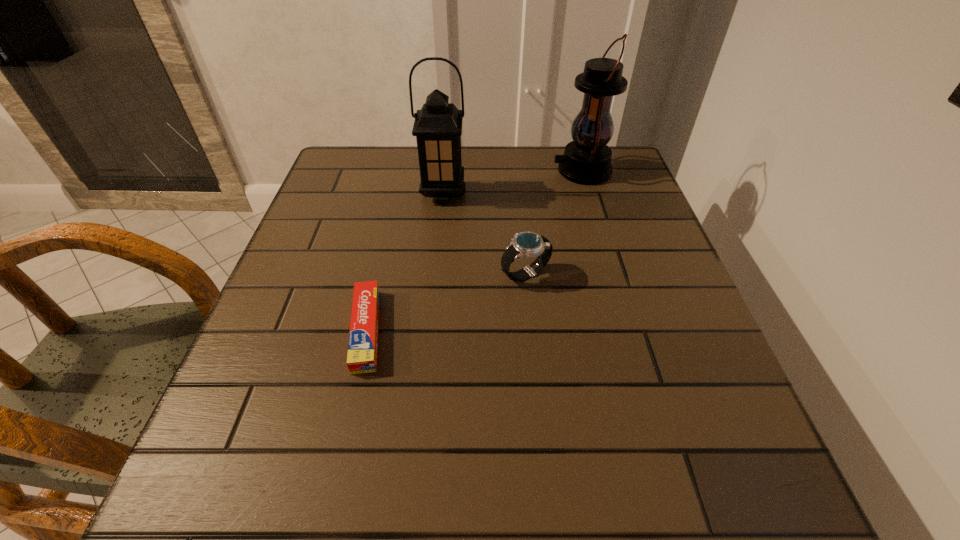
Find the location of a particular element. This screenshot has height=540, width=960. the rightmost object is located at coordinates (587, 159).

What are the coordinates of `the third object from right to left` in the screenshot? It's located at (438, 125).

You are a GUI agent. You are given a task and a screenshot of the screen. Output one action in this format:
    pyautogui.click(x=<x>, y=<y>)
    Task: Click on the third tallest object
    Image resolution: width=960 pixels, height=540 pixels.
    Given the screenshot: What is the action you would take?
    pyautogui.click(x=524, y=244)

You are a GUI agent. You are given a task and a screenshot of the screen. Output one action in this format:
    pyautogui.click(x=<x>, y=<y>)
    Task: Click on the watch
    This screenshot has height=540, width=960.
    Given the screenshot: What is the action you would take?
    pyautogui.click(x=524, y=244)

Find the location of a particular element. The width and height of the screenshot is (960, 540). the nearest object is located at coordinates (363, 338).

In order to click on the shortest object in this screenshot , I will do `click(363, 338)`.

Identify a few spots in free region located above the rightmost object, indicating its light source. Please provide its 2D coordinates. Your answer should be formatted as a tuple, i.e. [(x, y)], where the tuple contains the x and y coordinates of a point satisfying the conditions above.

[(405, 171)]

Can you point to a free location located above the rightmost object, indicating its light source? Please provide its 2D coordinates. Your answer should be formatted as a tuple, i.e. [(x, y)], where the tuple contains the x and y coordinates of a point satisfying the conditions above.

[(431, 171)]

Can you point to a free location located above the rightmost object, indicating its light source? Please provide its 2D coordinates. Your answer should be formatted as a tuple, i.e. [(x, y)], where the tuple contains the x and y coordinates of a point satisfying the conditions above.

[(423, 171)]

I want to click on free region located on the right of the second object from left to right, so click(517, 193).